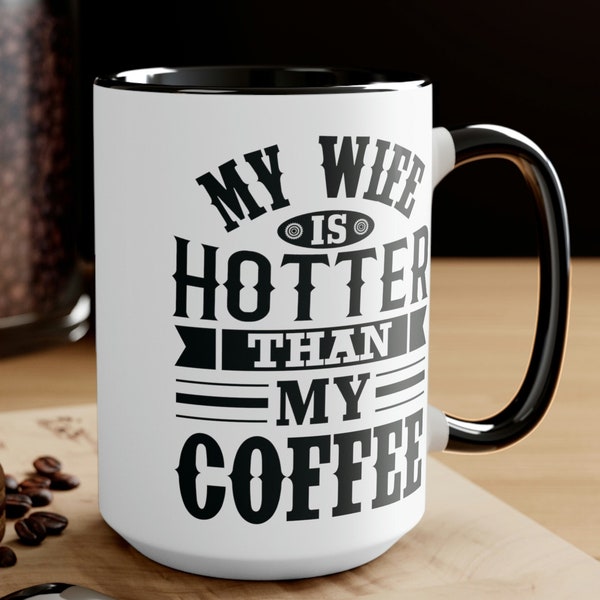
The width and height of the screenshot is (600, 600). Identify the location of tan wood floor behing mug. (475, 342), (567, 485).